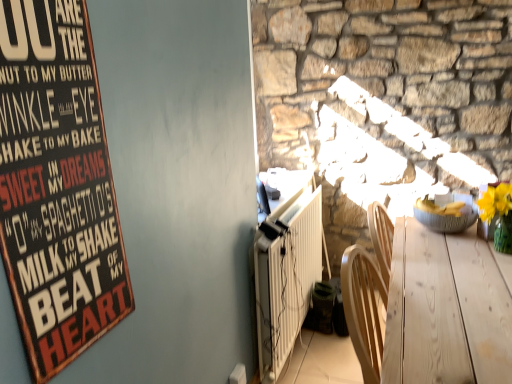
Question: From a real-world perspective, is white textured radiator at lower center above or below wooden signboard at upper left?

Choices:
 (A) below
 (B) above

Answer: (A)

Question: Relative to wooden signboard at upper left, is white textured radiator at lower center in front or behind?

Choices:
 (A) front
 (B) behind

Answer: (B)

Question: Estimate the real-world distances between objects in this image. Which object is farther from the matte gray bowl at right?

Choices:
 (A) light wood table at lower right
 (B) white textured radiator at lower center
 (C) wooden signboard at upper left

Answer: (C)

Question: Which object is the farthest from the white textured radiator at lower center?

Choices:
 (A) light wood table at lower right
 (B) wooden signboard at upper left
 (C) matte gray bowl at right

Answer: (B)